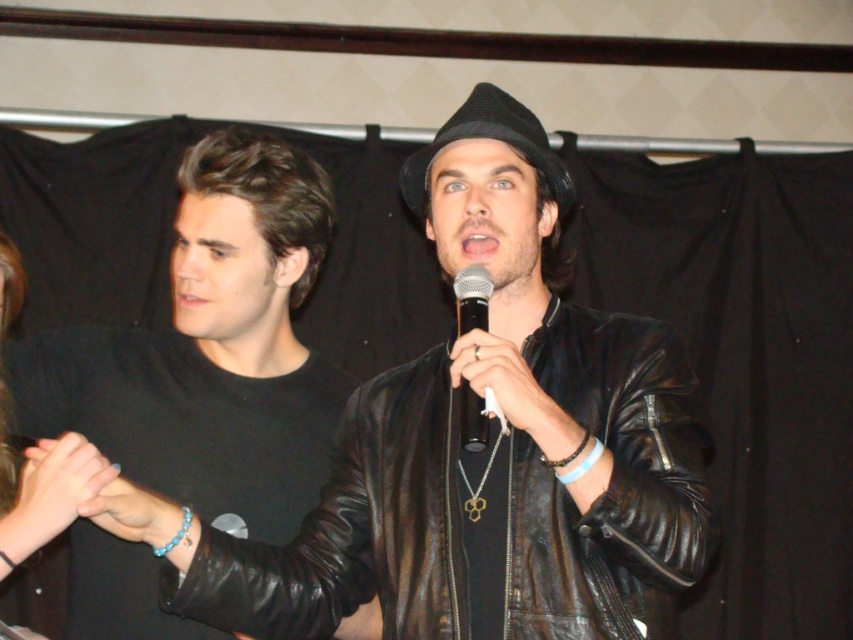
You are an event photographer positioned at the back of the room. You need to capture a clear photo of both the black felt fedora at center and the black matte microphone at center. Which object should you focus on first to ensure it appears sharp in the photo?

You should focus on the black felt fedora at center first because it is closer to you than the black matte microphone at center, so focusing on it will keep it sharp while the microphone may appear slightly blurred if the depth of field is limited.

You are organizing a stage setup and need to place a stand for the black leather jacket at center and the black matte microphone at center. If the stand can only accommodate one item at a time, which item should you prioritize placing first based on their widths?

The black leather jacket at center is wider than the black matte microphone at center, so you should prioritize placing the black leather jacket at center first to ensure it fits properly on the stand.